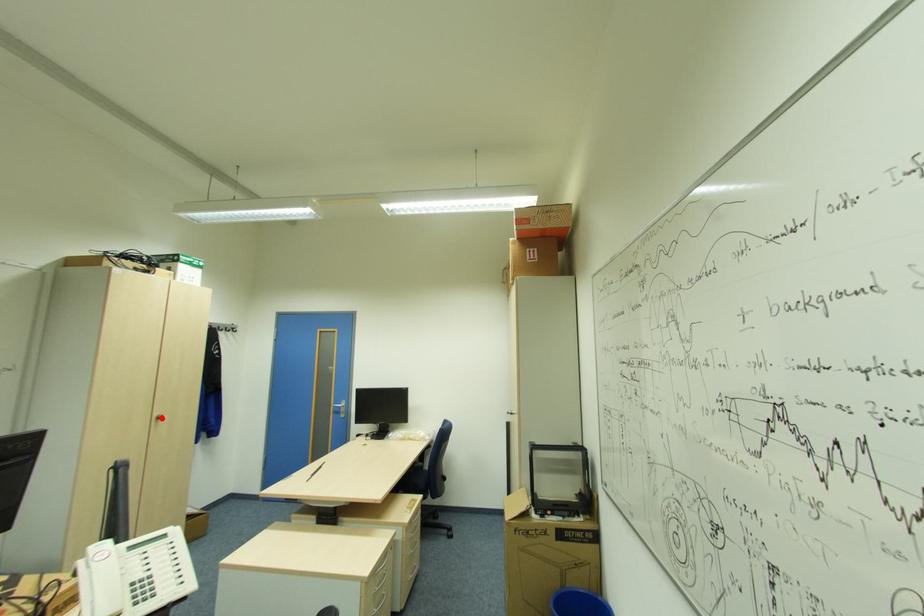
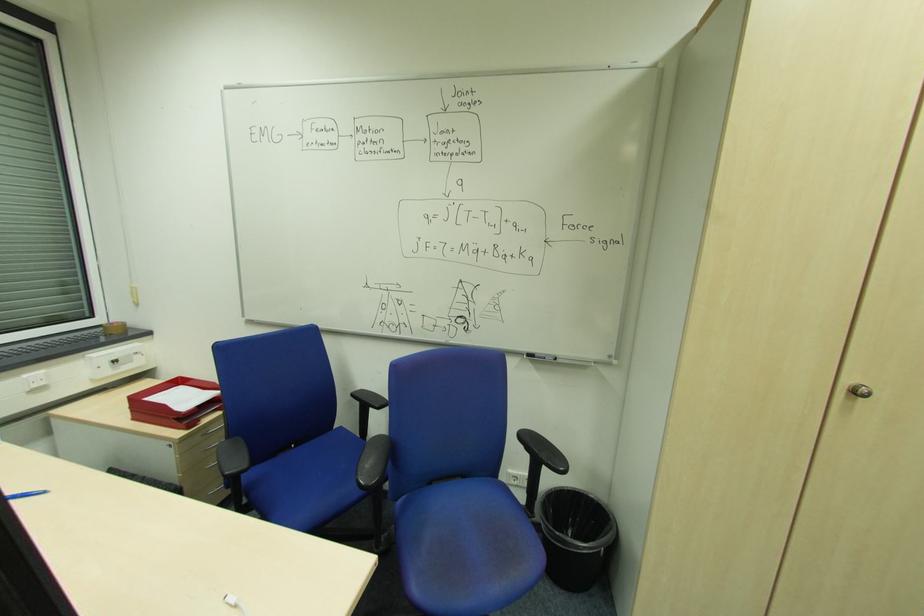
Find the pixel in the second image that matches the highlighted location in the first image.

(860, 392)